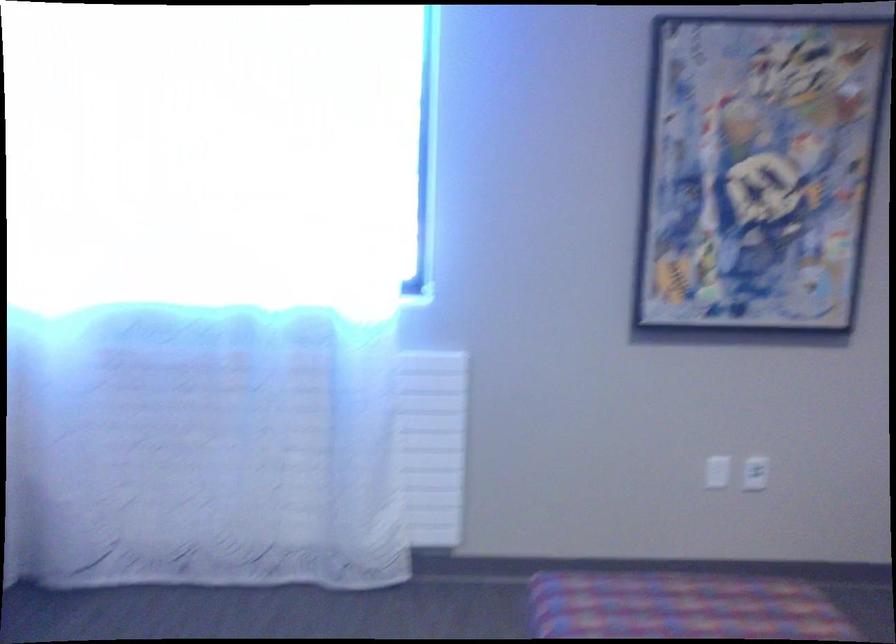
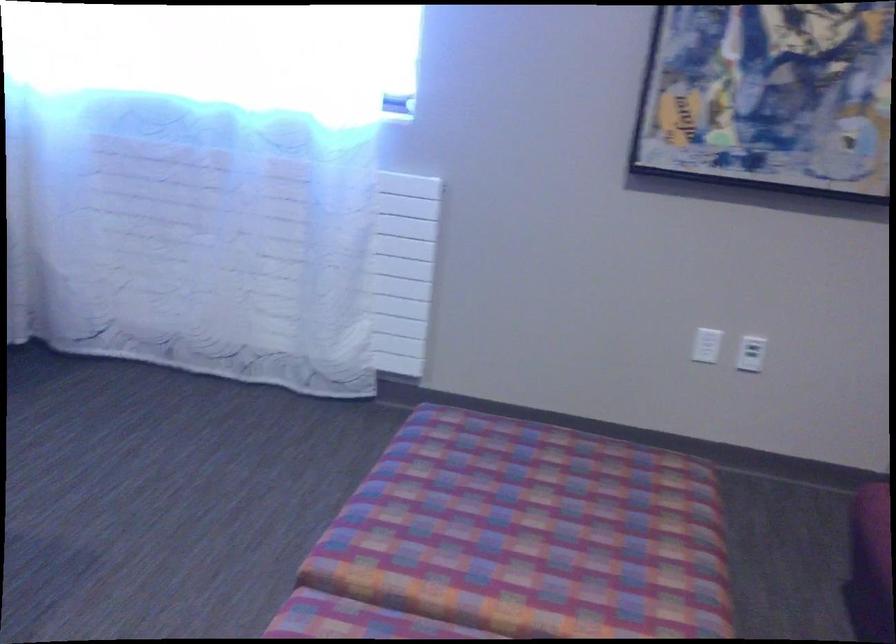
Question: The images are taken continuously from a first-person perspective. In which direction is your viewpoint rotating?

Choices:
 (A) Left
 (B) Right
 (C) Up
 (D) Down

Answer: (D)